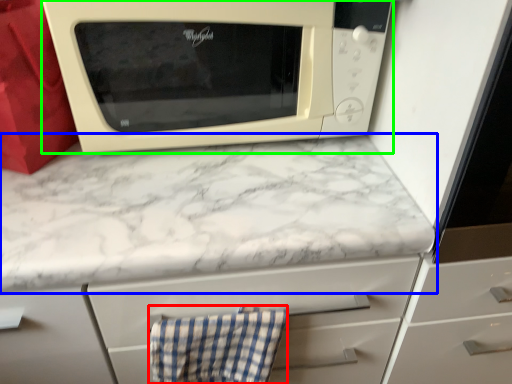
Question: Which object is the farthest from hand towel (highlighted by a red box)? Choose among these: countertop (highlighted by a blue box) or microwave oven (highlighted by a green box).

Choices:
 (A) countertop
 (B) microwave oven

Answer: (B)